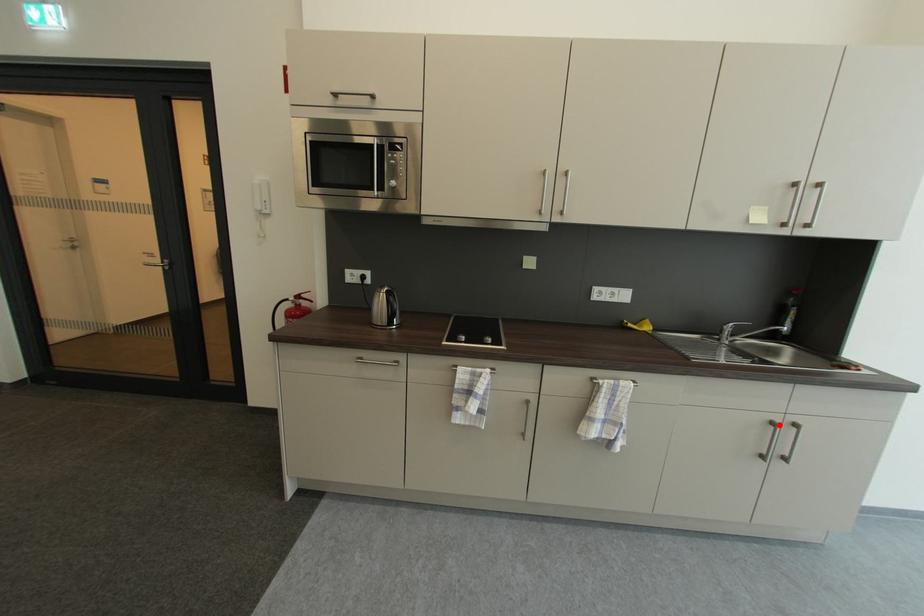
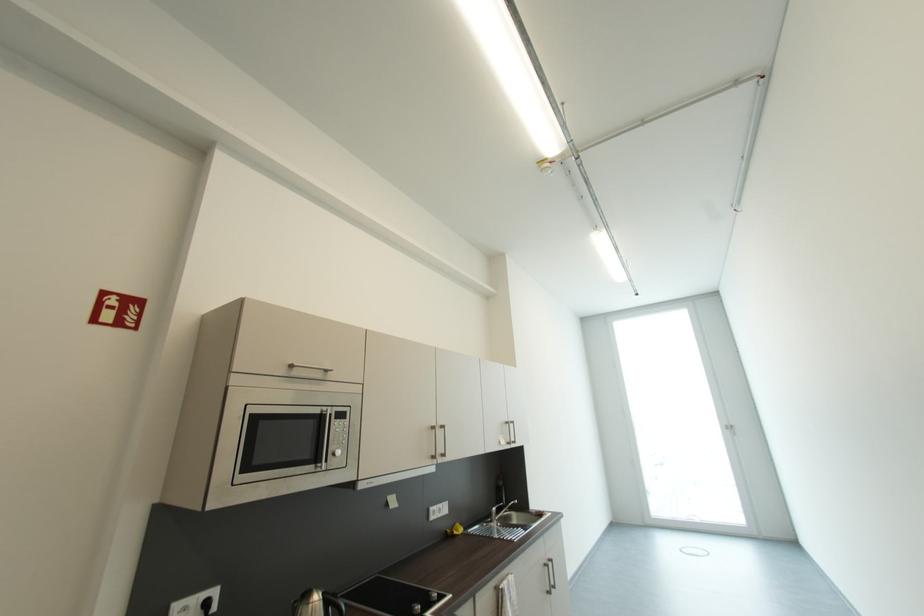
Where in the second image is the point corresponding to the highlighted location from the first image?

(552, 567)